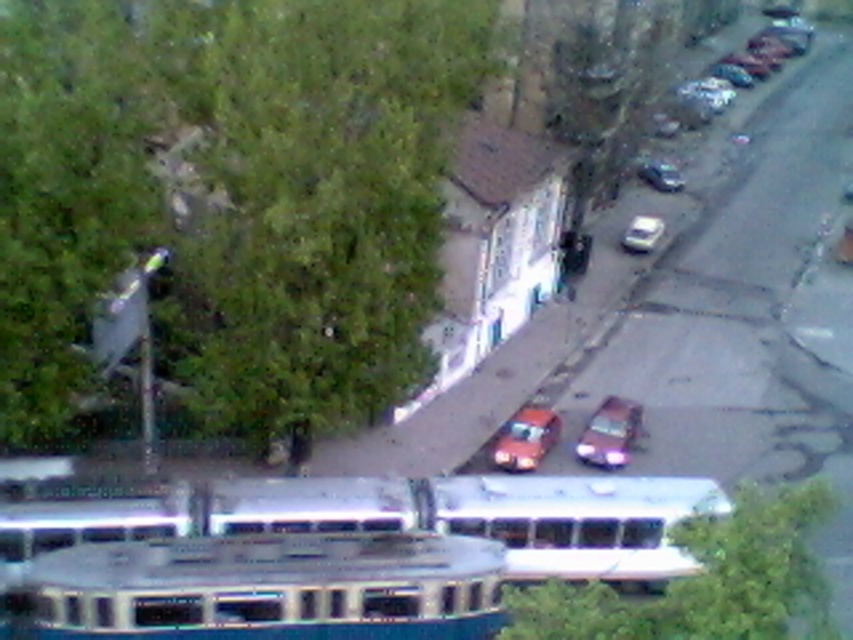
Who is shorter, metallic silver bus at lower left or metallic silver bus at center?

metallic silver bus at lower left

Describe the element at coordinates (260, 588) in the screenshot. This screenshot has width=853, height=640. I see `metallic silver bus at lower left` at that location.

Image resolution: width=853 pixels, height=640 pixels. Find the location of `metallic silver bus at lower left`. metallic silver bus at lower left is located at coordinates (260, 588).

Which is below, white glossy bus at center or shiny silver car at lower right?

white glossy bus at center is lower down.

How much distance is there between white glossy bus at center and shiny silver car at lower right?

white glossy bus at center is 26.62 feet from shiny silver car at lower right.

Is point (529, 576) less distant than point (616, 458)?

That is True.

The height and width of the screenshot is (640, 853). I want to click on white glossy bus at center, so click(x=578, y=522).

Does metallic silver bus at lower left appear on the left side of shiny orange car at center?

Indeed, metallic silver bus at lower left is positioned on the left side of shiny orange car at center.

Who is taller, metallic silver bus at lower left or shiny orange car at center?

With more height is metallic silver bus at lower left.

Is point (396, 532) closer to viewer compared to point (514, 458)?

That is True.

Where is `metallic silver bus at lower left`? metallic silver bus at lower left is located at coordinates (260, 588).